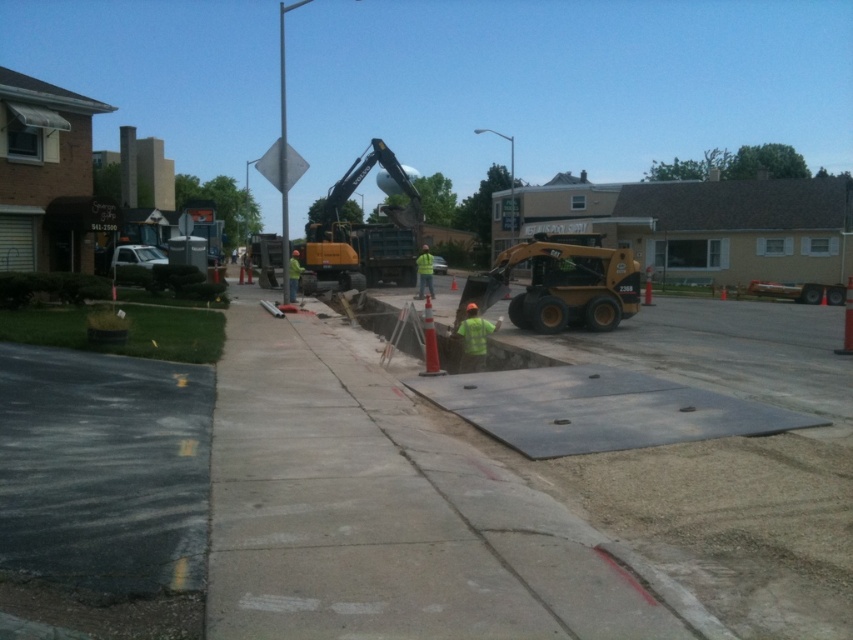
Question: Which of the following is the farthest from the observer?

Choices:
 (A) (233, 288)
 (B) (357, 164)
 (C) (590, 246)

Answer: (B)

Question: Is gray concrete pavement at center further to camera compared to green reflective vest at center?

Choices:
 (A) no
 (B) yes

Answer: (A)

Question: Which of the following is the farthest from the observer?

Choices:
 (A) (525, 244)
 (B) (337, 193)
 (C) (292, 262)
 (D) (418, 280)

Answer: (B)

Question: Can you confirm if yellow rubber skid steer loader at center is positioned to the right of yellow rubber excavator at center?

Choices:
 (A) yes
 (B) no

Answer: (A)

Question: Which point is farther to the camera?

Choices:
 (A) yellow reflective vest at center
 (B) gray concrete pavement at center
 (C) yellow rubber skid steer loader at center
 (D) green reflective vest at center

Answer: (A)

Question: Is yellow rubber skid steer loader at center wider than yellow reflective vest at center?

Choices:
 (A) yes
 (B) no

Answer: (A)